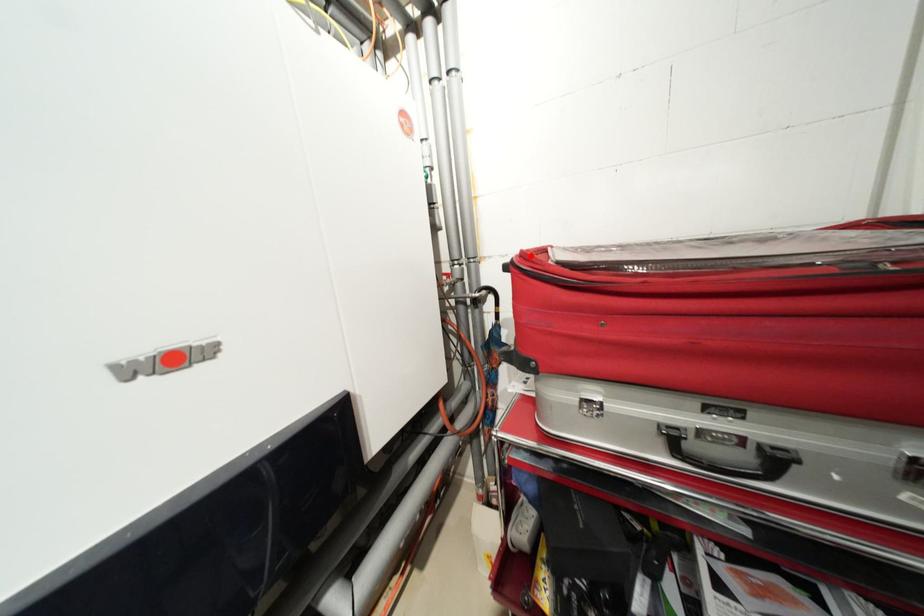
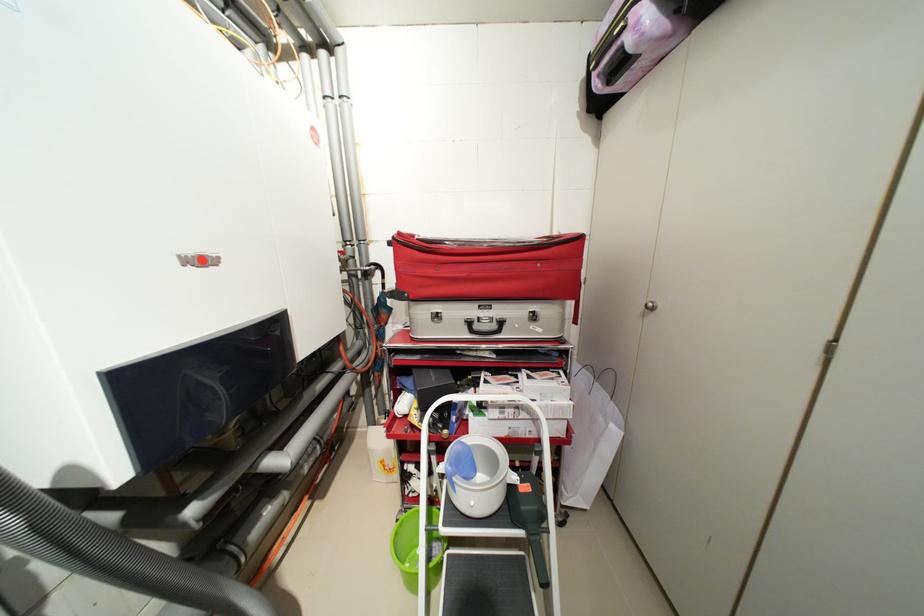
Locate, in the second image, the point that corresponds to the highlighted location in the first image.

(407, 235)